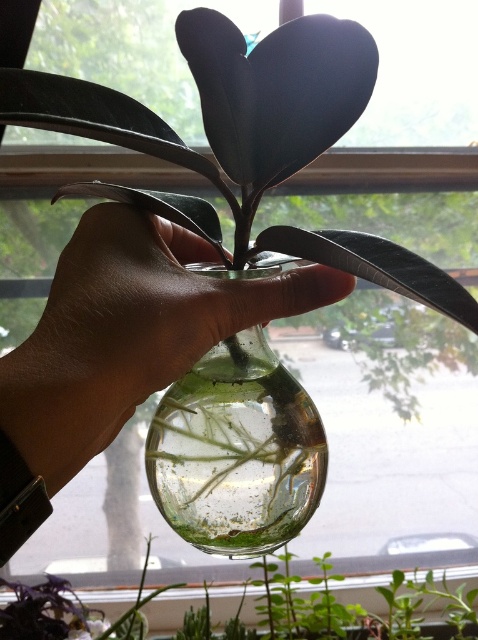
You are trying to determine the position of the transparent glass hand at center and the clear glass vase at center in the image. Based on the scene, which object is positioned higher?

The transparent glass hand at center is located above the clear glass vase at center, so it is positioned higher.

You are holding the clear glass bulb vase with the plant. You want to place it on a shelf that is 10 inches away from your current position. If the point at coordinates point [220,474] is where you are currently holding the vase, will you be able to reach the shelf without moving your hand more than 8.16 inches?

The point at coordinates point [220,474] is 8.16 inches away from the camera. Since the shelf is 10 inches away, you will need to move your hand an additional 1.84 inches beyond the current distance to reach it.

You are trying to place a sticker on the hand holding the glass bulb vase. The sticker is 0.05 units in size. Can you place it at point (129, 332) without overlapping the transparent glass hand at center?

The point (129, 332) is on the transparent glass hand at center, so placing the sticker there would overlap with the transparent glass hand at center. Choose another location.